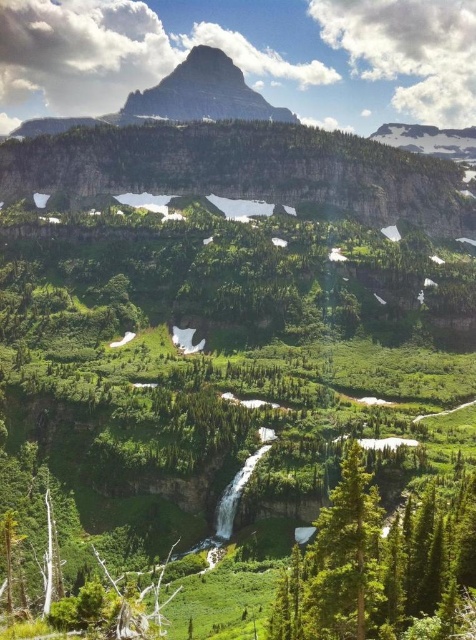
You are a hiker planning to take a photo of the rugged granite mountain at upper center from the green matte tree at lower center. Given that your camera has a maximum zoom range of 100 meters, will you be able to capture the mountain clearly without moving closer?

The green matte tree at lower center is 287.99 meters away from the rugged granite mountain at upper center. Since your camera can only zoom up to 100 meters, you won

You are standing at the origin point of the image coordinate system. You want to locate the green matte tree at lower center. In which direction should you move relative to your current position?

The green matte tree at lower center is located at point 0.880 on the x axis and 0.792 on the y axis. Since the origin is at the bottom left corner of the image, you should move to the right and slightly upward to reach it.

You are a hiker planning to set up a campsite in this mountainous area. You want to choose a spot that offers a clear view of both the green matte tree at lower center and the rugged granite mountain at upper center. Based on their size in the image, which object would require you to position your campsite closer to it to ensure it remains visible?

The green matte tree at lower center occupies less space than the rugged granite mountain at upper center, so you would need to position your campsite closer to the green matte tree at lower center to ensure it remains visible, as smaller objects require closer proximity to maintain visibility.